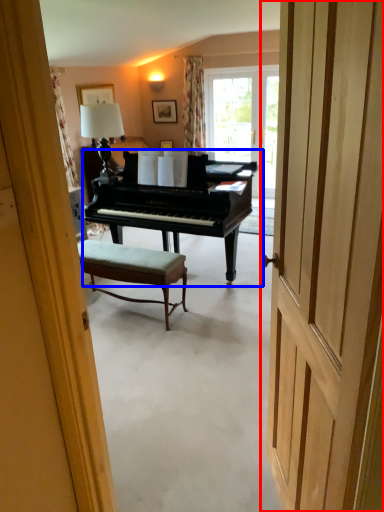
Question: Which object appears closest to the camera in this image, door (highlighted by a red box) or piano (highlighted by a blue box)?

Choices:
 (A) door
 (B) piano

Answer: (A)